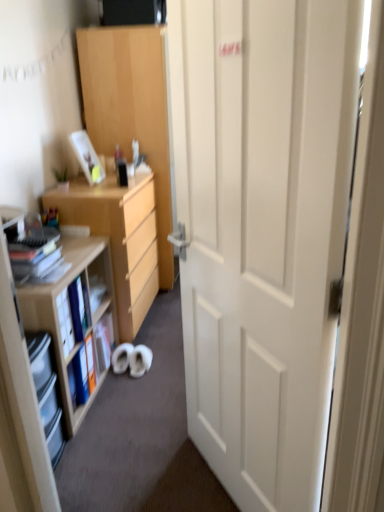
Question: Considering the relative sizes of clear plastic shelves at left, positioned as the second shelf in back-to-front order, and matte black book at left in the image provided, is clear plastic shelves at left, positioned as the second shelf in back-to-front order, shorter than matte black book at left?

Choices:
 (A) no
 (B) yes

Answer: (A)

Question: Would you say clear plastic shelves at left, positioned as the second shelf in back-to-front order, is outside matte black book at left?

Choices:
 (A) yes
 (B) no

Answer: (A)

Question: Can you confirm if clear plastic shelves at left, the first shelf from the front, is thinner than matte black book at left?

Choices:
 (A) yes
 (B) no

Answer: (A)

Question: From a real-world perspective, is clear plastic shelves at left, positioned as the second shelf in back-to-front order, under matte black book at left?

Choices:
 (A) yes
 (B) no

Answer: (A)

Question: Are clear plastic shelves at left, positioned as the second shelf in back-to-front order, and matte black book at left beside each other?

Choices:
 (A) no
 (B) yes

Answer: (A)

Question: From the image's perspective, is clear plastic shelves at left, the first shelf from the front, under matte black book at left?

Choices:
 (A) yes
 (B) no

Answer: (A)

Question: Is the depth of light wood cabinet at center greater than that of light brown wooden desk at left?

Choices:
 (A) no
 (B) yes

Answer: (B)

Question: Can you confirm if light wood cabinet at center is bigger than light brown wooden desk at left?

Choices:
 (A) yes
 (B) no

Answer: (A)

Question: Can you see light wood cabinet at center touching light brown wooden desk at left?

Choices:
 (A) no
 (B) yes

Answer: (A)

Question: From a real-world perspective, does light wood cabinet at center stand above light brown wooden desk at left?

Choices:
 (A) yes
 (B) no

Answer: (A)

Question: Is light wood cabinet at center at the left side of light brown wooden desk at left?

Choices:
 (A) yes
 (B) no

Answer: (B)

Question: Does light wood cabinet at center have a greater width compared to light brown wooden desk at left?

Choices:
 (A) yes
 (B) no

Answer: (A)

Question: From the image's perspective, is light wood cabinet at center below clear plastic shelves at left, the first shelf from the front?

Choices:
 (A) no
 (B) yes

Answer: (A)